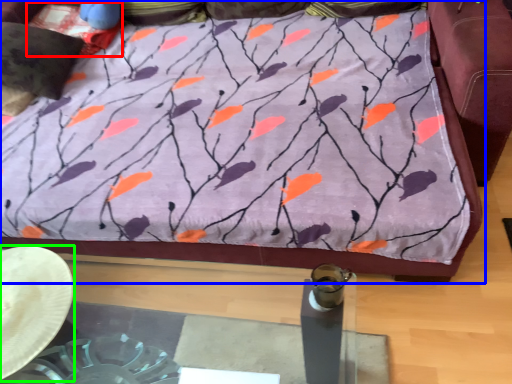
Question: Which object is the closest to the pillow (highlighted by a red box)? Choose among these: furniture (highlighted by a blue box) or cowboy hat (highlighted by a green box).

Choices:
 (A) furniture
 (B) cowboy hat

Answer: (A)